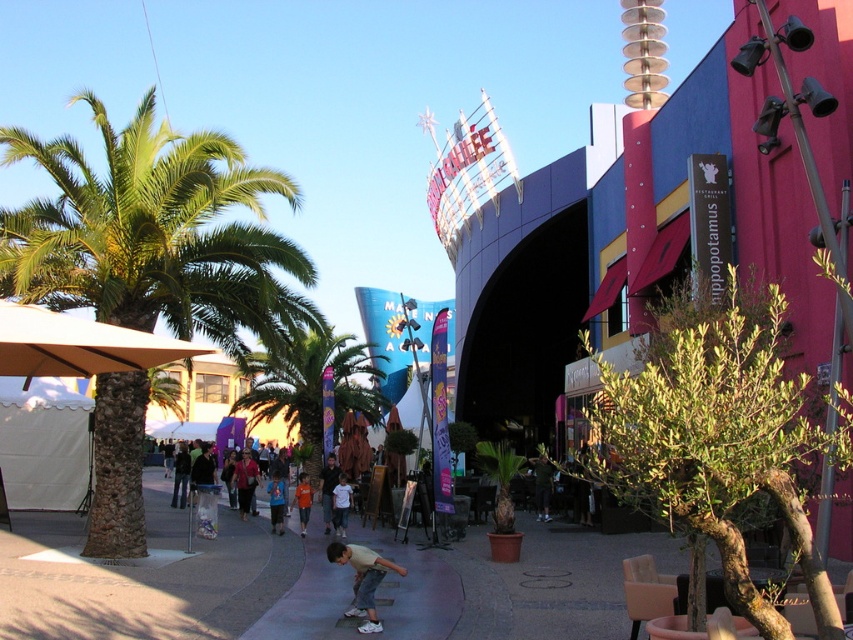
You are a visitor at the theme park and want to take a photo of the light brown wooden skateboard at lower center without the green leafy palm tree at left blocking the view. How should you position yourself?

Move to the right side of the light brown wooden skateboard at lower center so that the green leafy palm tree at left is no longer in front of it.

You are a visitor at the theme park and want to take a photo of the light brown shirt at lower center without the green leafy palm tree at center blocking the view. Can you move to a position where the palm tree won

The green leafy palm tree at center is closer to the viewer than the light brown shirt at lower center. To avoid the palm tree blocking the view, you should move to a position where you can stand behind the palm tree or adjust your angle so that the light brown shirt at lower center is visible while the palm tree is not in the foreground.